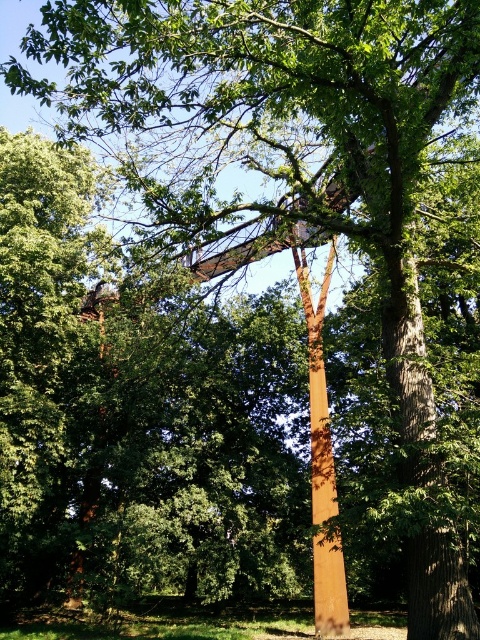
Question: Can you confirm if smooth brown tree trunk at center is thinner than golden polished pole at center?

Choices:
 (A) no
 (B) yes

Answer: (B)

Question: Which point appears closest to the camera in this image?

Choices:
 (A) (412, 374)
 (B) (328, 579)

Answer: (A)

Question: Does smooth brown tree trunk at center lie in front of golden polished pole at center?

Choices:
 (A) no
 (B) yes

Answer: (B)

Question: In this image, where is smooth brown tree trunk at center located relative to golden polished pole at center?

Choices:
 (A) above
 (B) below

Answer: (A)